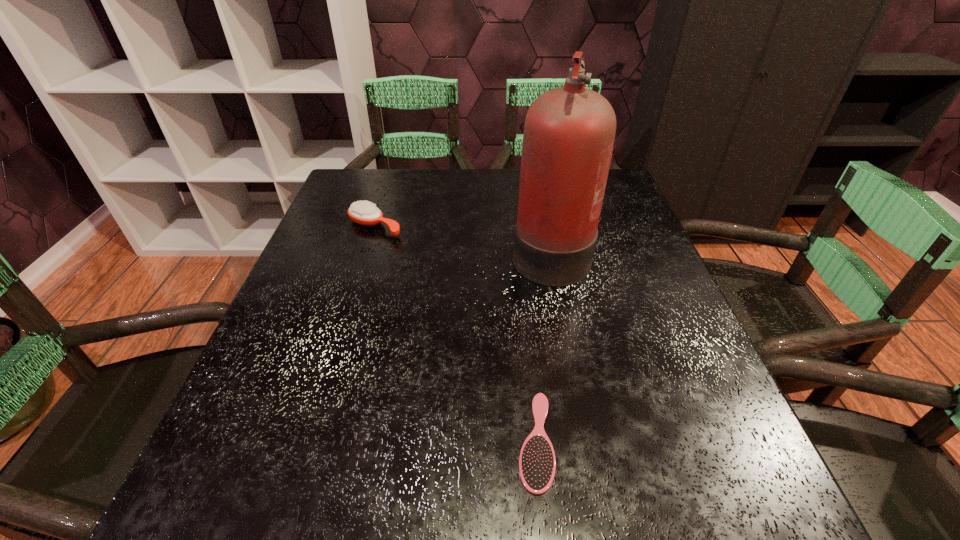
This screenshot has height=540, width=960. Find the location of `vacant area that lies between the farther hairbrush and the fire extinguisher`. vacant area that lies between the farther hairbrush and the fire extinguisher is located at coordinates (463, 239).

The height and width of the screenshot is (540, 960). I want to click on vacant area that lies between the tallest object and the nearest object, so click(542, 346).

I want to click on vacant region between the farther hairbrush and the nearest object, so click(x=455, y=334).

Identify the location of unoccupied position between the shorter hairbrush and the leftmost object. The image size is (960, 540). (455, 334).

This screenshot has height=540, width=960. Find the location of `free spot between the fire extinguisher and the taller hairbrush`. free spot between the fire extinguisher and the taller hairbrush is located at coordinates (463, 239).

Where is `free space between the farther hairbrush and the nearest object`? free space between the farther hairbrush and the nearest object is located at coordinates [x=455, y=334].

At what (x,y) coordinates should I click in order to perform the action: click on free space between the left hairbrush and the fire extinguisher. Please return your answer as a coordinate pair (x, y). This screenshot has width=960, height=540. Looking at the image, I should click on click(x=463, y=239).

Where is `vacant area that lies between the leftmost object and the shorter hairbrush`? vacant area that lies between the leftmost object and the shorter hairbrush is located at coordinates (455, 334).

You are a GUI agent. You are given a task and a screenshot of the screen. Output one action in this format:
    pyautogui.click(x=<x>, y=<y>)
    Task: Click on the free space between the shortest object and the fire extinguisher
    The width and height of the screenshot is (960, 540).
    Given the screenshot: What is the action you would take?
    pyautogui.click(x=542, y=346)

The width and height of the screenshot is (960, 540). Identify the location of free space between the nearer hairbrush and the tallest object. (542, 346).